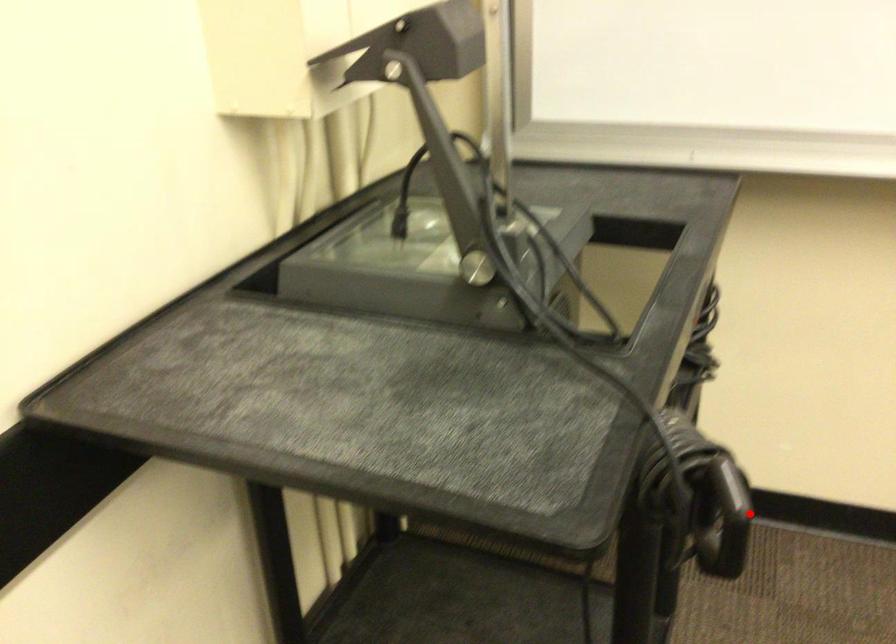
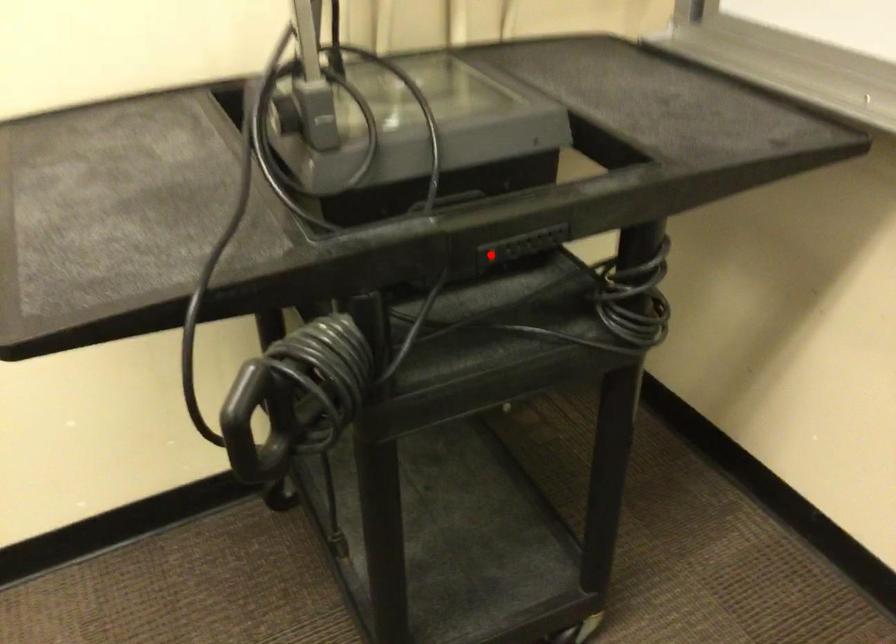
I am providing you with two images of the same scene from different viewpoints. A red point is marked on the first image and another point is marked on the second image. Is the red point in image1 aligned with the point shown in image2?

No